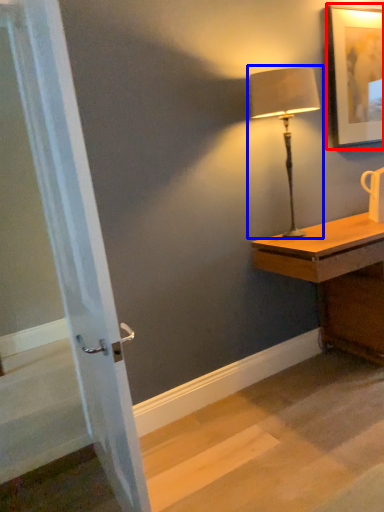
Question: Which point is closer to the camera, picture frame (highlighted by a red box) or lamp (highlighted by a blue box)?

Choices:
 (A) picture frame
 (B) lamp

Answer: (B)